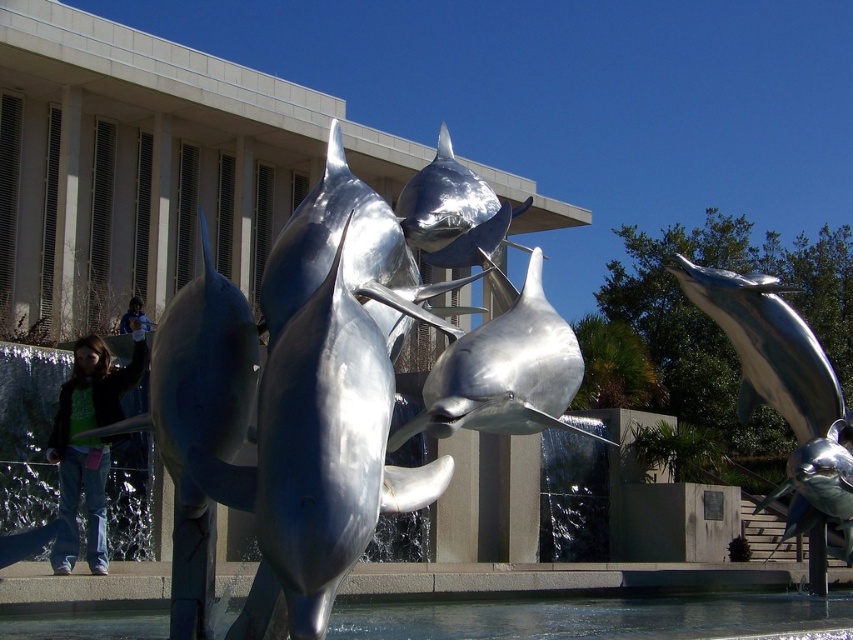
Who is more forward, (x=828, y=445) or (x=430, y=426)?

Point (x=430, y=426) is in front.

Can you confirm if shiny silver dolphin at right is taller than shiny silver dolphin at center?

Yes, shiny silver dolphin at right is taller than shiny silver dolphin at center.

Between point (811, 353) and point (434, 397), which one is positioned behind?

Point (811, 353)

Identify the location of shiny silver dolphin at right. (782, 388).

Is shiny silver dolphin at left to the left of shiny silver dolphin at right from the viewer's perspective?

Correct, you'll find shiny silver dolphin at left to the left of shiny silver dolphin at right.

Does shiny silver dolphin at left have a greater width compared to shiny silver dolphin at right?

Incorrect, shiny silver dolphin at left's width does not surpass shiny silver dolphin at right's.

The height and width of the screenshot is (640, 853). Find the location of `shiny silver dolphin at left`. shiny silver dolphin at left is located at coordinates (202, 390).

Can you confirm if shiny metallic dolphin at center is positioned to the left of clear water at lower center?

Correct, you'll find shiny metallic dolphin at center to the left of clear water at lower center.

Which is more to the right, shiny metallic dolphin at center or clear water at lower center?

Positioned to the right is clear water at lower center.

At what (x,y) coordinates should I click in order to perform the action: click on shiny metallic dolphin at center. Please return your answer as a coordinate pair (x, y). The image size is (853, 640). Looking at the image, I should click on (331, 442).

Where is `shiny metallic dolphin at center`? shiny metallic dolphin at center is located at coordinates click(331, 442).